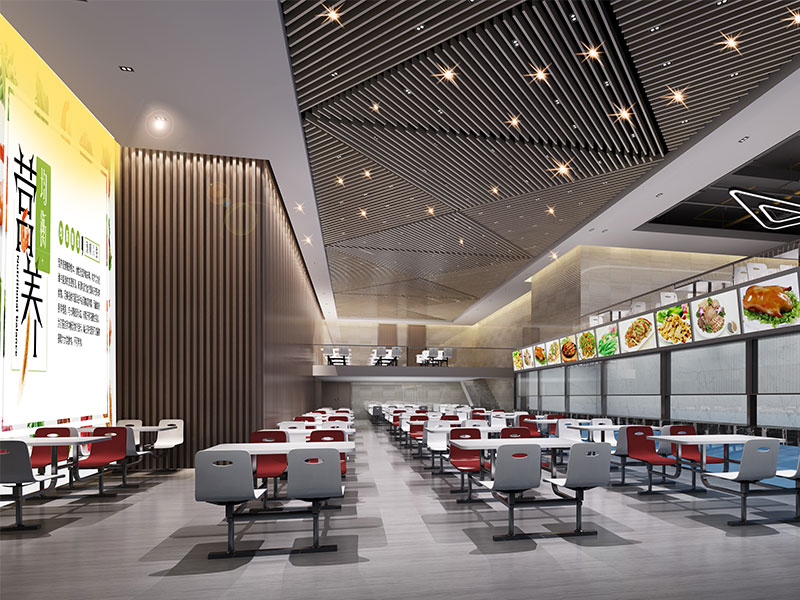
Where is `floor`? floor is located at coordinates (x=164, y=500), (x=389, y=467), (x=652, y=519).